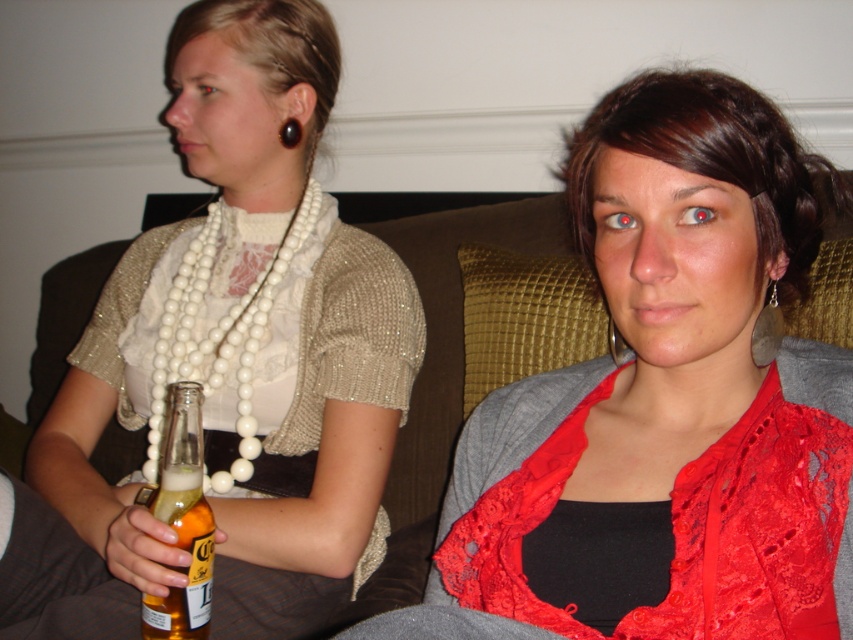
Question: Is pearl necklace at left thinner than translucent glass bottle at lower left?

Choices:
 (A) yes
 (B) no

Answer: (B)

Question: Is lace fabric top at center positioned in front of white pearl necklace at left?

Choices:
 (A) no
 (B) yes

Answer: (B)

Question: Where is pearl necklace at left located in relation to white pearl necklace at left in the image?

Choices:
 (A) above
 (B) below

Answer: (A)

Question: Which of the following is the farthest from the observer?

Choices:
 (A) lace fabric top at center
 (B) pearl necklace at left
 (C) white pearl necklace at left

Answer: (C)

Question: Which is farther from the pearl necklace at left?

Choices:
 (A) translucent glass bottle at lower left
 (B) white pearl necklace at left

Answer: (A)

Question: Which object is farther from the camera taking this photo?

Choices:
 (A) pearl necklace at left
 (B) lace fabric top at center

Answer: (A)